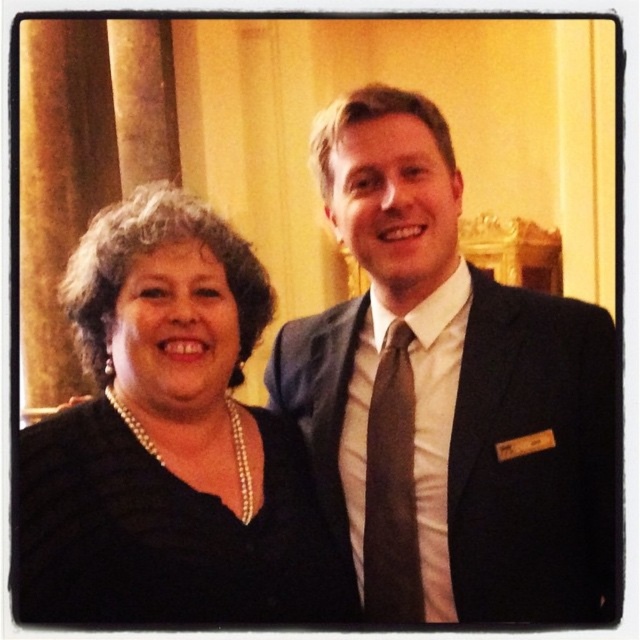
Question: Which of the following is the closest to the observer?

Choices:
 (A) (355, 131)
 (B) (198, 545)

Answer: (B)

Question: Does matte black suit at center come in front of brown silk tie at center?

Choices:
 (A) no
 (B) yes

Answer: (B)

Question: Which is nearer to the pearl necklace at left?

Choices:
 (A) brown silk tie at center
 (B) matte black suit at center

Answer: (A)

Question: Is matte black suit at center behind pearl necklace at left?

Choices:
 (A) no
 (B) yes

Answer: (A)

Question: Which point is farther to the camera?

Choices:
 (A) brown silk tie at center
 (B) pearl necklace at left
 (C) matte black suit at center

Answer: (A)

Question: Is pearl necklace at left above brown silk tie at center?

Choices:
 (A) yes
 (B) no

Answer: (A)